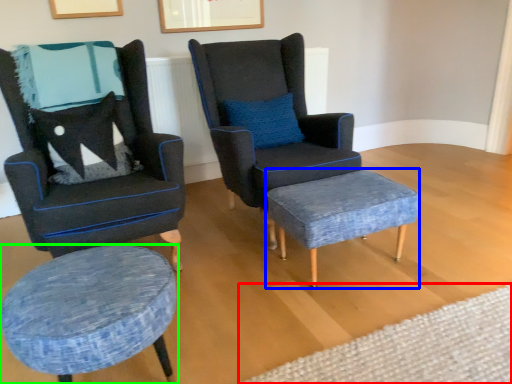
Question: Estimate the real-world distances between objects in this image. Which object is farther from plain (highlighted by a red box), stool (highlighted by a blue box) or stool (highlighted by a green box)?

Choices:
 (A) stool
 (B) stool

Answer: (B)